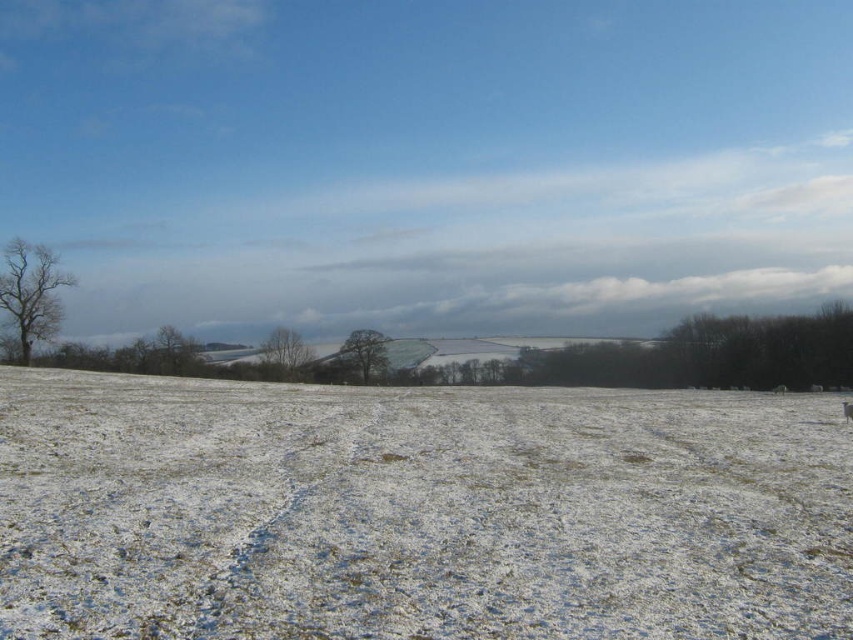
You are an artist sketching the winter landscape. You notice the bare branches at left and the green matte tree at center. Which object is positioned to the left of the other?

The bare branches at left are to the left of the green matte tree at center.

You are an artist planning to paint this winter scene. You want to emphasize the contrast between the bare branches at left and the green matte tree at center. Which tree should you make larger in your painting to highlight this contrast?

To emphasize the contrast between the bare branches at left and the green matte tree at center, you should make the green matte tree at center larger than the bare branches at left, as it is already larger in the scene.

You are an observer standing in the snow field. You notice the white powdery snow at center and the bare branches at left. Which object is closer to the ground?

The white powdery snow at center is positioned under bare branches at left, so it is closer to the ground than the bare branches at left.